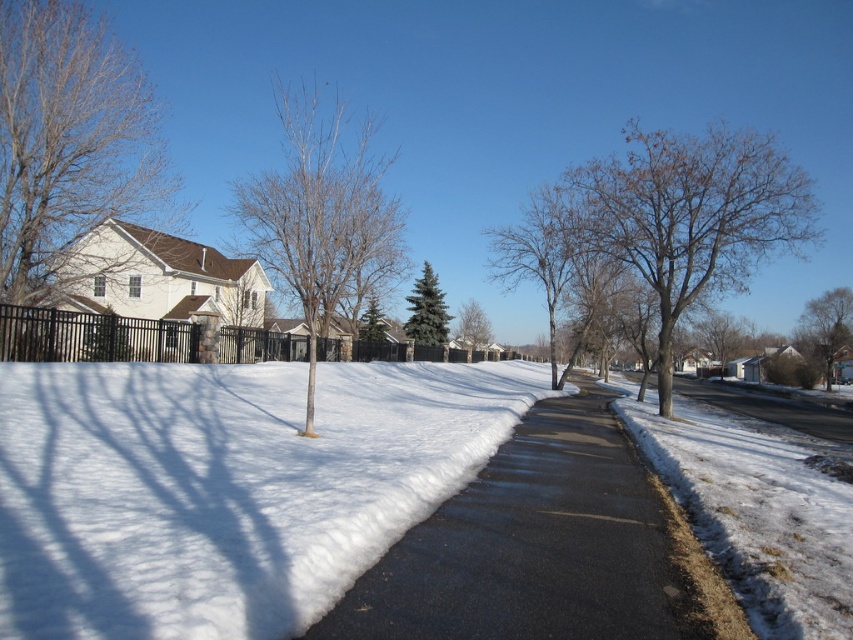
Question: Is black metal fence at center wider than bare branches at center?

Choices:
 (A) yes
 (B) no

Answer: (A)

Question: Which object appears closest to the camera in this image?

Choices:
 (A) brown leafy tree at upper right
 (B) green textured evergreen tree at center
 (C) green matte tree at center

Answer: (A)

Question: Which of these objects is positioned closest to the brown leafless tree at left?

Choices:
 (A) bare branches at center
 (B) green matte tree at center
 (C) brown leafless tree at right
 (D) bare wood tree at center

Answer: (D)

Question: Is white fluffy snow at center positioned before black metal fence at center?

Choices:
 (A) yes
 (B) no

Answer: (A)

Question: Is black metal fence at center positioned before green textured evergreen tree at center?

Choices:
 (A) yes
 (B) no

Answer: (A)

Question: Which of the following is the closest to the observer?

Choices:
 (A) (376, 333)
 (B) (125, 429)
 (C) (68, 349)

Answer: (B)